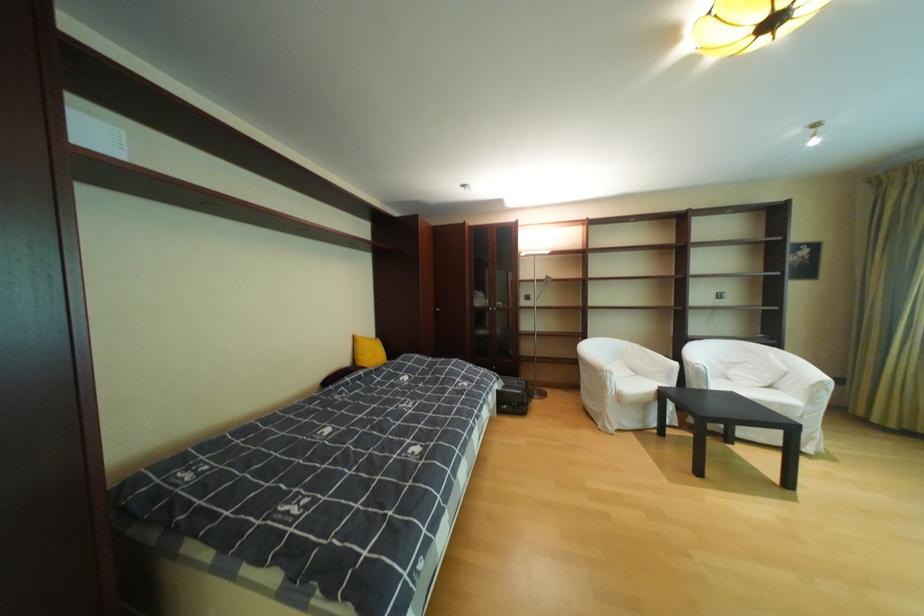
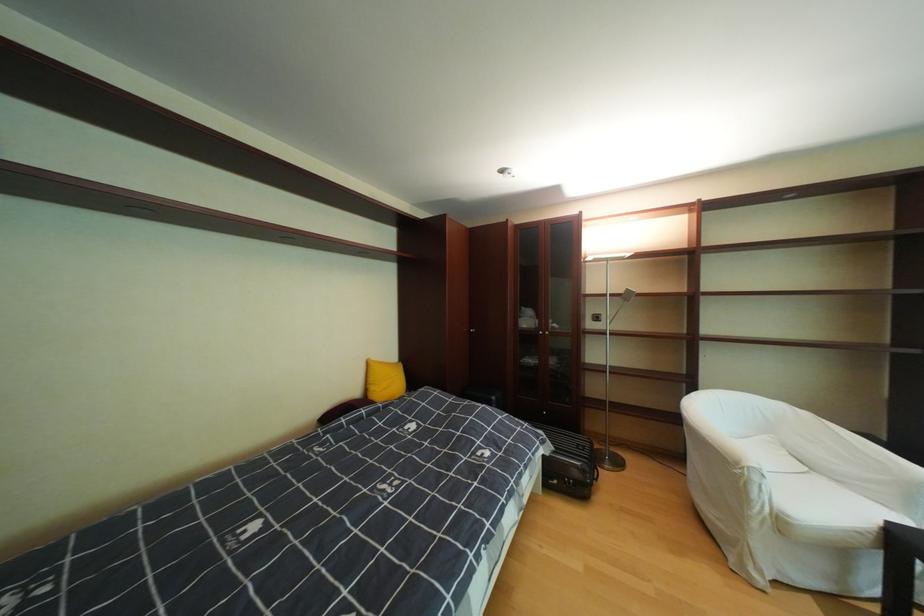
In the second image, find the point that corresponds to the point at 526,405 in the first image.

(580, 483)